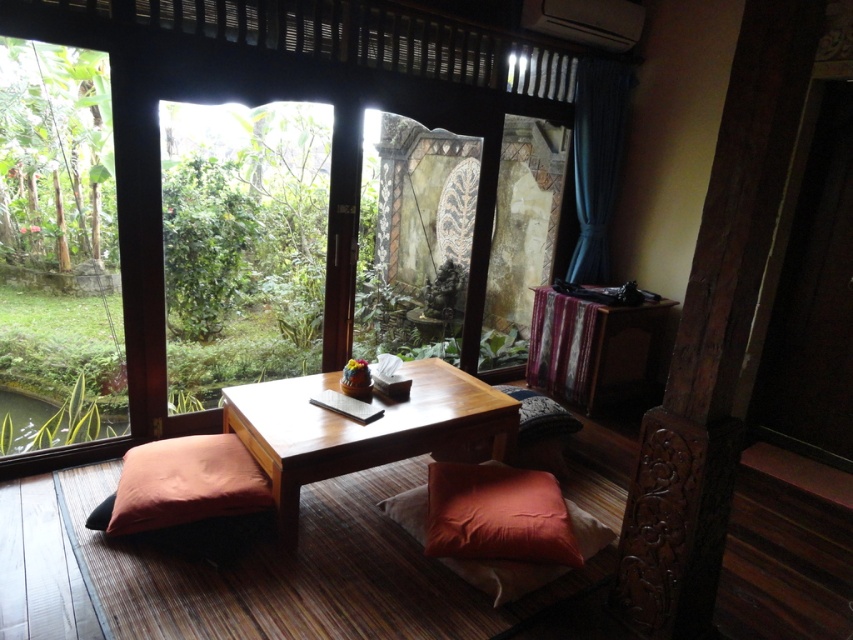
Measure the distance between point (482, 388) and camera.

They are 3.20 meters apart.

Can you confirm if wooden table at center is shorter than velvet orange cushion at lower center?

In fact, wooden table at center may be taller than velvet orange cushion at lower center.

The image size is (853, 640). I want to click on wooden table at center, so click(358, 428).

Locate an element on the screen. wooden table at center is located at coordinates (358, 428).

Who is more forward, (476, 468) or (579, 77)?

Positioned in front is point (476, 468).

Between velvet orange cushion at lower center and dark blue fabric curtain at upper right, which one appears on the right side from the viewer's perspective?

dark blue fabric curtain at upper right

Which is behind, point (503, 484) or point (621, 109)?

Positioned behind is point (621, 109).

You are a GUI agent. You are given a task and a screenshot of the screen. Output one action in this format:
    pyautogui.click(x=<x>, y=<y>)
    Task: Click on the velvet orange cushion at lower center
    The height and width of the screenshot is (640, 853).
    Given the screenshot: What is the action you would take?
    pyautogui.click(x=497, y=515)

Which is above, wooden table at center or wooden pad at center?

wooden pad at center is higher up.

From the picture: Is wooden table at center above wooden pad at center?

Actually, wooden table at center is below wooden pad at center.

The width and height of the screenshot is (853, 640). What do you see at coordinates (358, 428) in the screenshot? I see `wooden table at center` at bounding box center [358, 428].

Where is `wooden table at center`? The width and height of the screenshot is (853, 640). wooden table at center is located at coordinates (358, 428).